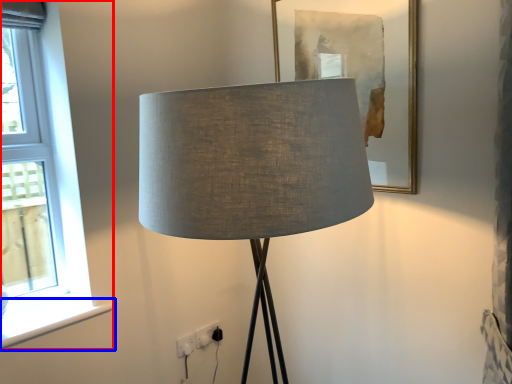
Question: Which point is further to the camera, window (highlighted by a red box) or window sill (highlighted by a blue box)?

Choices:
 (A) window
 (B) window sill

Answer: (B)